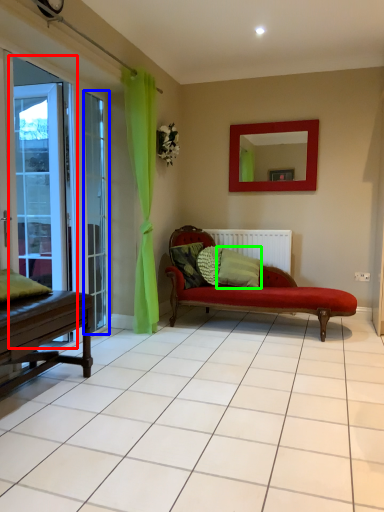
Question: Estimate the real-world distances between objects in this image. Which object is farther from screen door (highlighted by a red box), window (highlighted by a blue box) or pillow (highlighted by a green box)?

Choices:
 (A) window
 (B) pillow

Answer: (B)